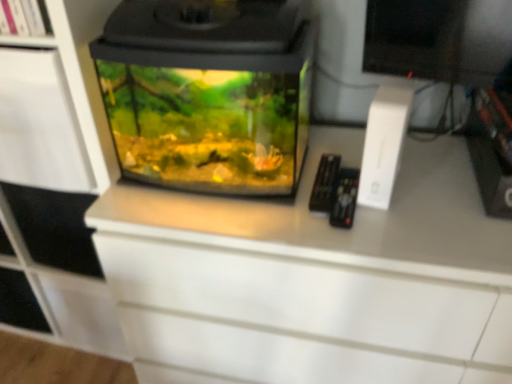
The height and width of the screenshot is (384, 512). Describe the element at coordinates (26, 25) in the screenshot. I see `white matte shelf at upper left` at that location.

The height and width of the screenshot is (384, 512). What are the coordinates of `transparent glass aquarium at center` in the screenshot? It's located at (207, 93).

From the image's perspective, between transparent glass aquarium at center and white matte shelf at upper left, which one is located above?

white matte shelf at upper left appears higher in the image.

Is transparent glass aquarium at center spatially inside white matte shelf at upper left, or outside of it?

transparent glass aquarium at center is not enclosed by white matte shelf at upper left.

Considering the positions of point (209, 181) and point (48, 41), is point (209, 181) closer or farther from the camera than point (48, 41)?

Point (209, 181) is positioned farther from the camera compared to point (48, 41).

Based on their positions, is transparent glass aquarium at center located to the left or right of white matte shelf at upper left?

transparent glass aquarium at center is to the right of white matte shelf at upper left.

From a real-world perspective, is white matte shelf at upper left physically located above or below white matte cabinet at left?

white matte shelf at upper left is above white matte cabinet at left.

At what (x,y) coordinates should I click in order to perform the action: click on cabinetry below the white matte shelf at upper left (from the image's perspective). Please return your answer as a coordinate pair (x, y). Image resolution: width=512 pixels, height=384 pixels. Looking at the image, I should click on (59, 171).

Does white matte shelf at upper left have a lesser height compared to white matte cabinet at left?

Yes.

Would you consider white matte shelf at upper left to be distant from transparent glass aquarium at center?

No, there isn't a large distance between white matte shelf at upper left and transparent glass aquarium at center.

Does point (0, 31) appear closer or farther from the camera than point (168, 17)?

Clearly, point (0, 31) is more distant from the camera than point (168, 17).

From a real-world perspective, is white matte shelf at upper left positioned over transparent glass aquarium at center based on gravity?

Yes, from a real-world perspective, white matte shelf at upper left is on top of transparent glass aquarium at center.

Does white matte shelf at upper left contain transparent glass aquarium at center?

No, transparent glass aquarium at center is not a part of white matte shelf at upper left.

Is white matte cabinet at left facing towards transparent glass aquarium at center?

No, white matte cabinet at left is not aimed at transparent glass aquarium at center.

Where is `cabinetry behind the transparent glass aquarium at center`? The width and height of the screenshot is (512, 384). cabinetry behind the transparent glass aquarium at center is located at coordinates (59, 171).

Considering the sizes of objects white matte cabinet at left and transparent glass aquarium at center in the image provided, who is bigger, white matte cabinet at left or transparent glass aquarium at center?

Bigger between the two is white matte cabinet at left.

Is white matte cabinet at left placed right next to transparent glass aquarium at center?

They are not placed beside each other.

From a real-world perspective, relative to white matte shelf at upper left, is white matte cabinet at left vertically above or below?

From a real-world perspective, white matte cabinet at left is physically below white matte shelf at upper left.

Which object is positioned more to the right, white matte cabinet at left or white matte shelf at upper left?

white matte shelf at upper left is more to the right.

Considering the sizes of white matte cabinet at left and white matte shelf at upper left in the image, is white matte cabinet at left wider or thinner than white matte shelf at upper left?

Clearly, white matte cabinet at left has more width compared to white matte shelf at upper left.

Can you confirm if white matte cabinet at left is shorter than white matte shelf at upper left?

No, white matte cabinet at left is not shorter than white matte shelf at upper left.

From the image's perspective, which is above, transparent glass aquarium at center or white matte cabinet at left?

transparent glass aquarium at center is shown above in the image.

From a real-world perspective, between transparent glass aquarium at center and white matte cabinet at left, who is vertically lower?

white matte cabinet at left, from a real-world perspective.

Is transparent glass aquarium at center inside or outside of white matte cabinet at left?

transparent glass aquarium at center cannot be found inside white matte cabinet at left.

This screenshot has width=512, height=384. I want to click on shelf above the transparent glass aquarium at center (from a real-world perspective), so click(26, 25).

I want to click on shelf that is above the white matte cabinet at left (from the image's perspective), so (x=26, y=25).

When comparing their distances from transparent glass aquarium at center, does white matte shelf at upper left or white matte cabinet at left seem further?

white matte shelf at upper left lies further to transparent glass aquarium at center than the other object.

Which object lies further to the anchor point white matte cabinet at left, transparent glass aquarium at center or white matte shelf at upper left?

Based on the image, white matte shelf at upper left appears to be further to white matte cabinet at left.

When comparing their distances from transparent glass aquarium at center, does white matte cabinet at left or white matte shelf at upper left seem closer?

white matte cabinet at left is closer to transparent glass aquarium at center.

Considering their positions, is transparent glass aquarium at center positioned closer to white matte shelf at upper left than white matte cabinet at left?

Among the two, white matte cabinet at left is located nearer to white matte shelf at upper left.

Based on their spatial positions, is white matte shelf at upper left or transparent glass aquarium at center further from white matte cabinet at left?

white matte shelf at upper left.

From the image, which object appears to be farther from white matte shelf at upper left, white matte cabinet at left or transparent glass aquarium at center?

Based on the image, transparent glass aquarium at center appears to be further to white matte shelf at upper left.

The width and height of the screenshot is (512, 384). Find the location of `shelf situated between white matte cabinet at left and transparent glass aquarium at center from left to right`. shelf situated between white matte cabinet at left and transparent glass aquarium at center from left to right is located at coordinates (26, 25).